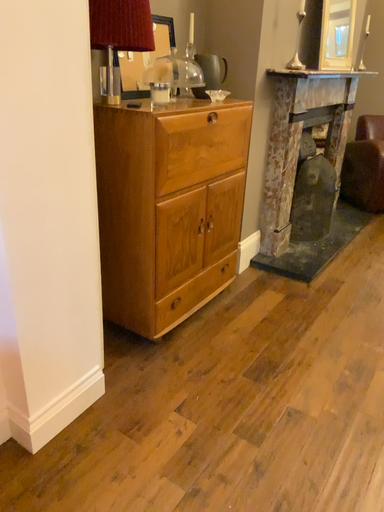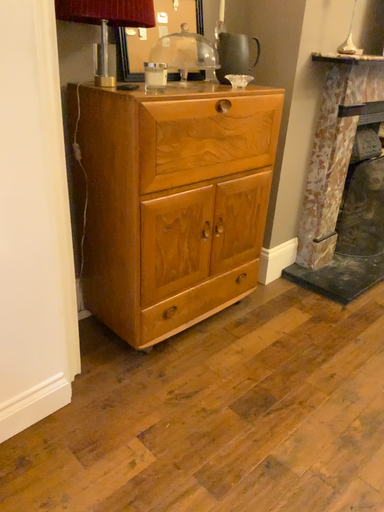
Question: Which way did the camera rotate in the video?

Choices:
 (A) rotated left
 (B) rotated right

Answer: (A)